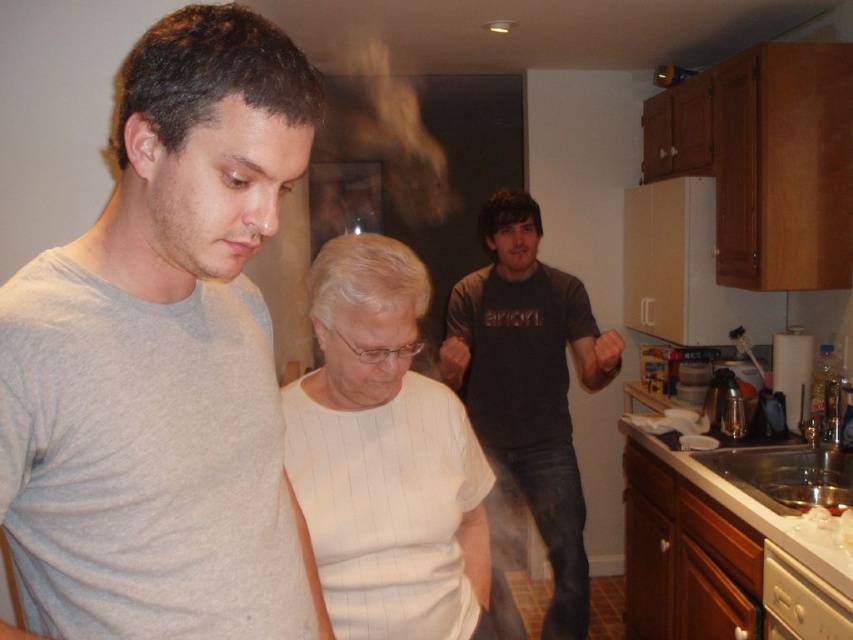
Question: Is gray cotton t-shirt at upper left above dark gray t-shirt at center?

Choices:
 (A) no
 (B) yes

Answer: (B)

Question: Which point is farther to the camera?

Choices:
 (A) gray cotton t-shirt at upper left
 (B) white striped shirt at center

Answer: (B)

Question: Does gray cotton t-shirt at upper left have a lesser width compared to white striped shirt at center?

Choices:
 (A) yes
 (B) no

Answer: (A)

Question: Can you confirm if gray cotton t-shirt at upper left is thinner than dark gray t-shirt at center?

Choices:
 (A) yes
 (B) no

Answer: (A)

Question: Which point appears farthest from the camera in this image?

Choices:
 (A) (396, 332)
 (B) (554, 490)
 (C) (189, 218)

Answer: (B)

Question: Estimate the real-world distances between objects in this image. Which object is farther from the dark gray t-shirt at center?

Choices:
 (A) gray cotton t-shirt at upper left
 (B) white striped shirt at center

Answer: (A)